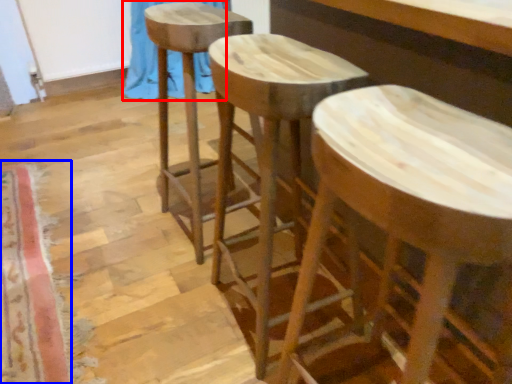
Question: Which point is closer to the camera, curtain (highlighted by a red box) or mat (highlighted by a blue box)?

Choices:
 (A) curtain
 (B) mat

Answer: (B)